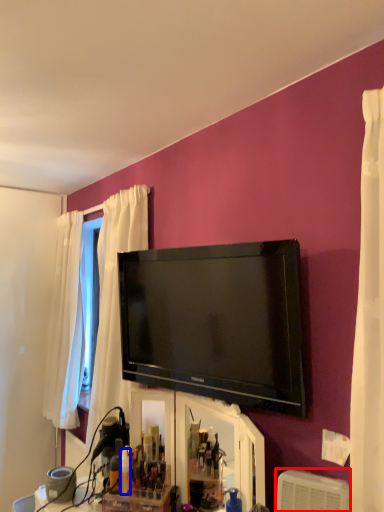
Question: Which point is closer to the camera, air conditioner (highlighted by a red box) or toiletry (highlighted by a blue box)?

Choices:
 (A) air conditioner
 (B) toiletry

Answer: (A)